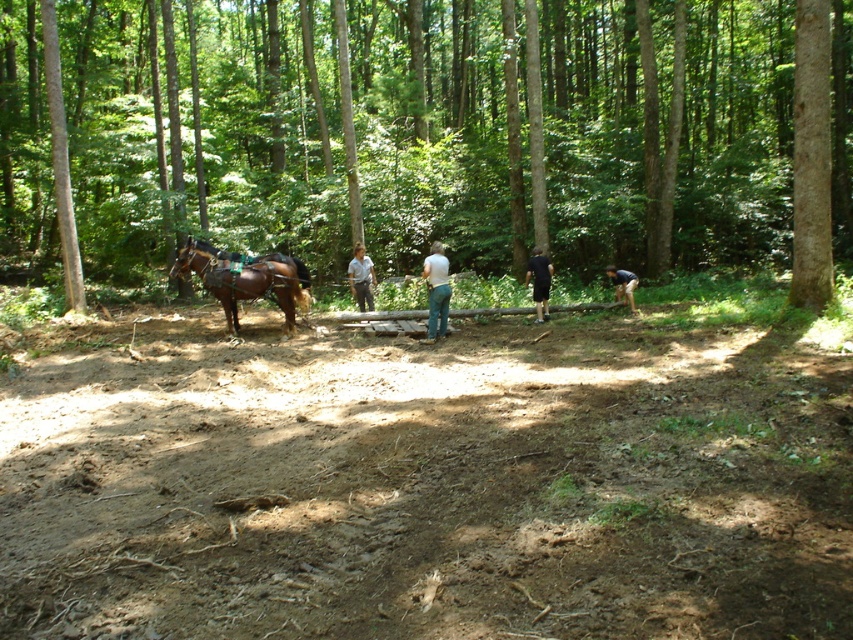
Does light brown leather jacket at center appear over dark blue shirt at lower right?

Indeed, light brown leather jacket at center is positioned over dark blue shirt at lower right.

Can you confirm if light brown leather jacket at center is shorter than dark blue shirt at lower right?

In fact, light brown leather jacket at center may be taller than dark blue shirt at lower right.

Is point (352, 285) positioned in front of point (622, 298)?

Yes, it is.

Identify the location of light brown leather jacket at center. (361, 276).

Is brown dirt track at center shorter than dark blue shirt at lower right?

No, brown dirt track at center is not shorter than dark blue shirt at lower right.

Which is above, brown dirt track at center or dark blue shirt at lower right?

dark blue shirt at lower right is above.

Between point (136, 483) and point (636, 276), which one is positioned behind?

Point (636, 276)

At what (x,y) coordinates should I click in order to perform the action: click on brown dirt track at center. Please return your answer as a coordinate pair (x, y). This screenshot has height=640, width=853. Looking at the image, I should click on (428, 484).

Who is higher up, brown dirt track at center or light brown leather jacket at center?

light brown leather jacket at center

Between brown dirt track at center and light brown leather jacket at center, which one is positioned lower?

brown dirt track at center

Is point (207, 467) positioned before point (360, 275)?

That is True.

The height and width of the screenshot is (640, 853). Find the location of `brown dirt track at center`. brown dirt track at center is located at coordinates (428, 484).